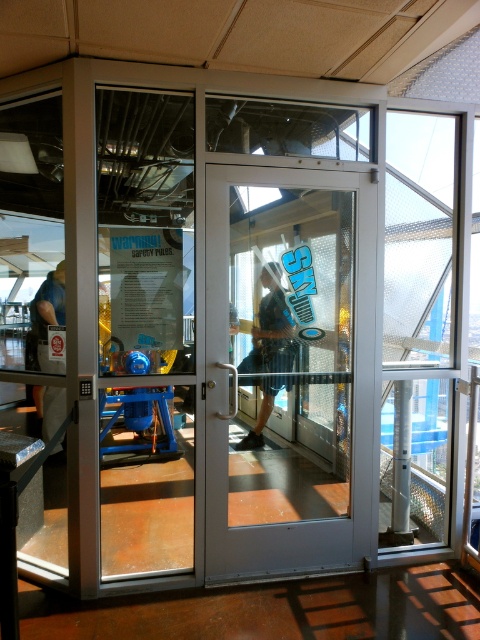
Question: Which point is farther to the camera?

Choices:
 (A) white glossy door at center
 (B) blue denim shorts at center
 (C) matte black shirt at left

Answer: (C)

Question: Does white glossy door at center appear on the left side of blue denim shorts at center?

Choices:
 (A) no
 (B) yes

Answer: (A)

Question: Is white glossy door at center wider than blue denim shorts at center?

Choices:
 (A) no
 (B) yes

Answer: (B)

Question: Which point is closer to the camera taking this photo?

Choices:
 (A) (249, 458)
 (B) (261, 435)

Answer: (A)

Question: Which object is closer to the camera taking this photo?

Choices:
 (A) white glossy door at center
 (B) matte black shirt at left

Answer: (A)

Question: Is white glossy door at center wider than blue denim shorts at center?

Choices:
 (A) no
 (B) yes

Answer: (B)